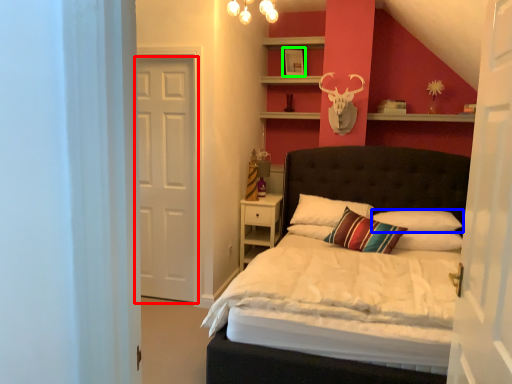
Question: Considering the real-world distances, which object is closest to door (highlighted by a red box)? pillow (highlighted by a blue box) or picture frame (highlighted by a green box).

Choices:
 (A) pillow
 (B) picture frame

Answer: (B)